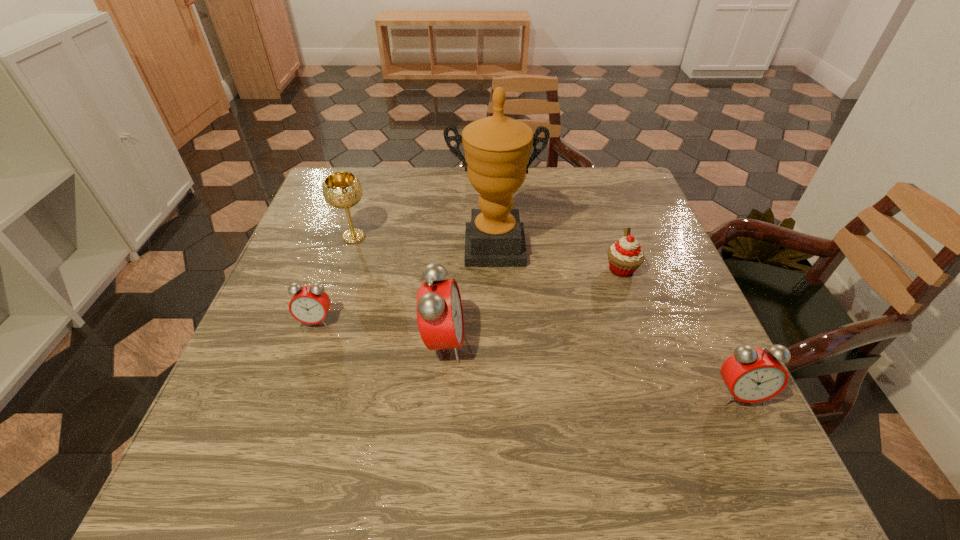
This screenshot has height=540, width=960. Find the location of `vacant space located on the left of the second object from right to left`. vacant space located on the left of the second object from right to left is located at coordinates (441, 269).

Find the location of a particular element. The height and width of the screenshot is (540, 960). free spot located 0.150m on the right of the chalice is located at coordinates (429, 237).

I want to click on object that is at the near edge, so click(752, 375).

You are a GUI agent. You are given a task and a screenshot of the screen. Output one action in this format:
    pyautogui.click(x=<x>, y=<y>)
    Task: Click on the alarm clock that is at the left edge
    The width and height of the screenshot is (960, 540).
    Given the screenshot: What is the action you would take?
    pyautogui.click(x=309, y=304)

Where is `chalice present at the left edge`? This screenshot has width=960, height=540. chalice present at the left edge is located at coordinates (343, 190).

Locate an element on the screen. alarm clock that is at the right edge is located at coordinates (752, 375).

Where is `cupcake positioned at the right edge`? cupcake positioned at the right edge is located at coordinates (625, 256).

At what (x,y) coordinates should I click in order to perform the action: click on object at the near right corner. Please return your answer as a coordinate pair (x, y). Looking at the image, I should click on (752, 375).

Locate an element on the screen. The image size is (960, 540). free spot at the far edge of the desktop is located at coordinates (567, 183).

In the image, there is a desktop. Where is `vacant area at the near edge`? vacant area at the near edge is located at coordinates click(x=545, y=387).